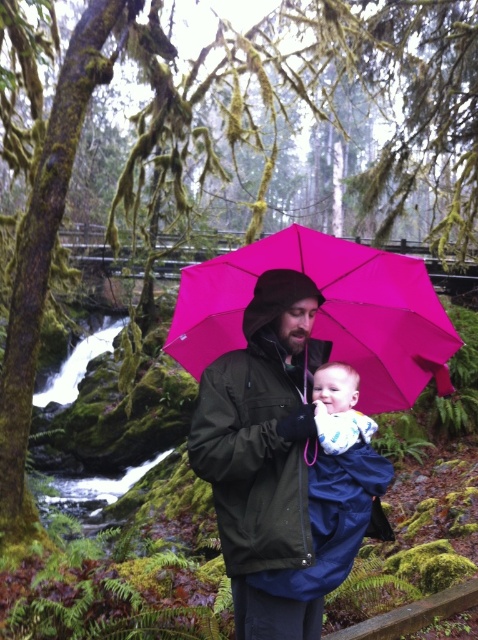
Question: In this image, where is blue fabric baby at center located relative to blue cotton onesie at center?

Choices:
 (A) right
 (B) left

Answer: (A)

Question: Which point is closer to the camera?

Choices:
 (A) blue cotton onesie at center
 (B) pink matte umbrella at center

Answer: (B)

Question: Which of the following is the closest to the observer?

Choices:
 (A) blue fabric baby at center
 (B) pink matte umbrella at center

Answer: (B)

Question: Based on their relative distances, which object is nearer to the blue fabric baby at center?

Choices:
 (A) matte black jacket at center
 (B) blue cotton onesie at center
 (C) pink matte umbrella at center

Answer: (B)

Question: Can you confirm if matte black jacket at center is positioned above blue cotton onesie at center?

Choices:
 (A) yes
 (B) no

Answer: (B)

Question: Can you confirm if matte black jacket at center is positioned above blue cotton onesie at center?

Choices:
 (A) no
 (B) yes

Answer: (A)